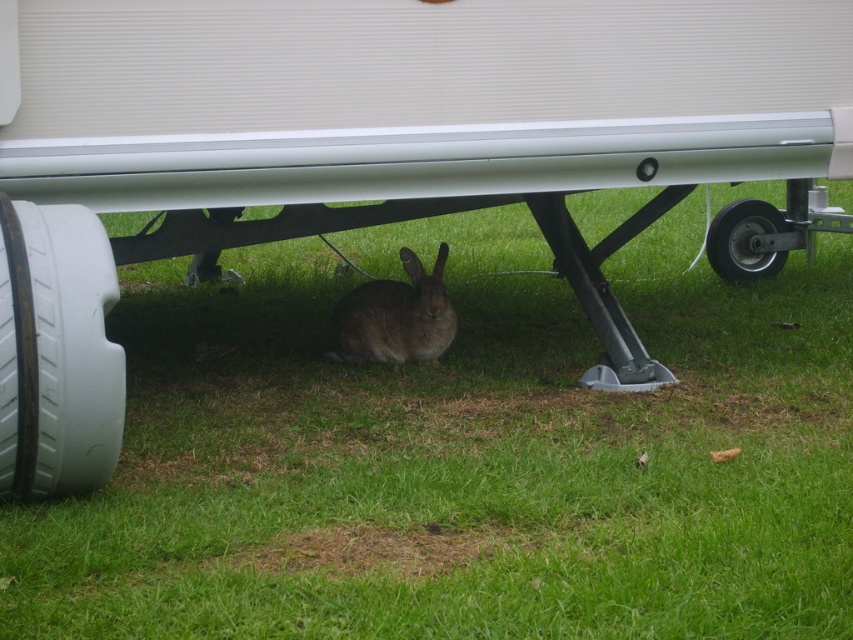
You are a gardener working near the caravan. You need to place a small potted plant between the brown fur rabbit at center and the black rubber tire at lower right. Based on their positions, where should you place the potted plant?

The brown fur rabbit at center is located below the black rubber tire at lower right, so you should place the potted plant between them either above the rabbit or below the tire depending on the desired position.

You are a wildlife photographer trying to capture a rabbit under a caravan. You notice the brown fur rabbit at center and the black rubber tire at lower right. Which object is taller when viewed from the ground level?

The brown fur rabbit at center is much taller than the black rubber tire at lower right, so the rabbit would appear taller in your photo taken from ground level.